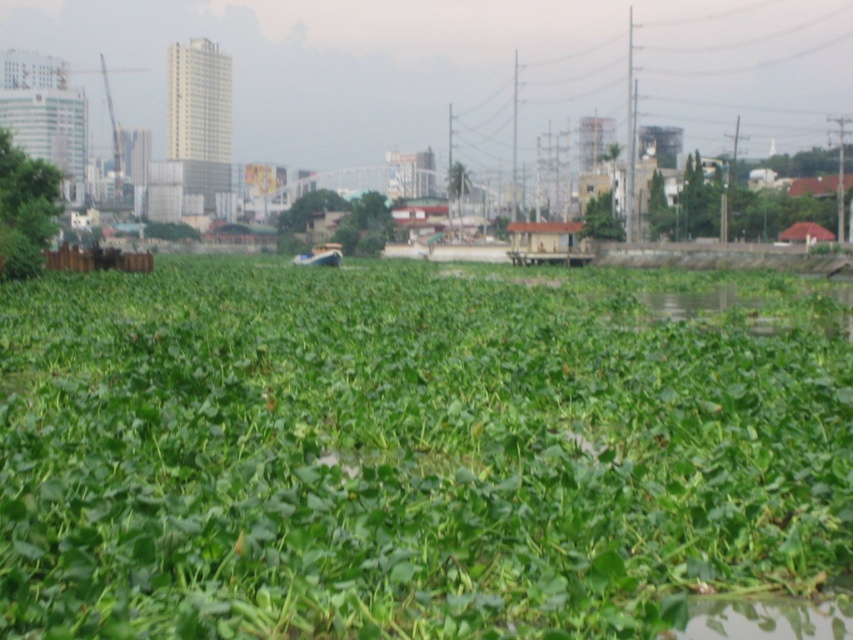
Question: Is green leafy plants at center bigger than green leafy plant at left?

Choices:
 (A) yes
 (B) no

Answer: (A)

Question: Is green leafy plants at center to the left of green leafy plant at left from the viewer's perspective?

Choices:
 (A) yes
 (B) no

Answer: (B)

Question: Where is green leafy plants at center located in relation to green leafy plant at left in the image?

Choices:
 (A) left
 (B) right

Answer: (B)

Question: Which point is closer to the camera?

Choices:
 (A) (6, 211)
 (B) (242, 388)

Answer: (B)

Question: Among these points, which one is nearest to the camera?

Choices:
 (A) (663, 628)
 (B) (35, 220)

Answer: (A)